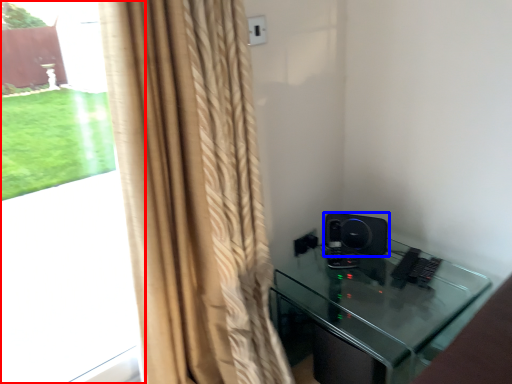
Question: Which point is further to the camera, bay window (highlighted by a red box) or speaker (highlighted by a blue box)?

Choices:
 (A) bay window
 (B) speaker

Answer: (B)